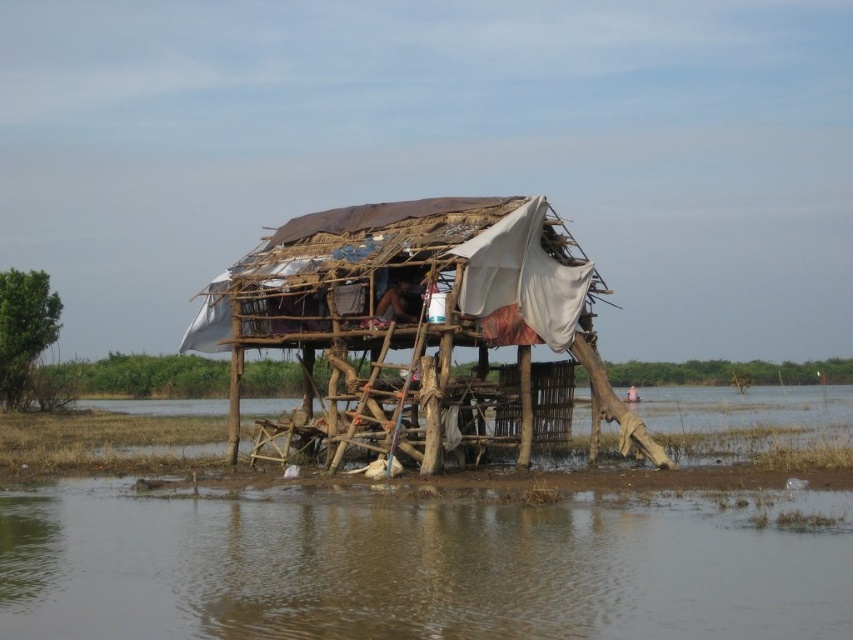
Who is positioned more to the right, brown muddy water at lower center or rusty wood shack at center?

brown muddy water at lower center is more to the right.

Who is more distant from viewer, (801,552) or (505,436)?

Point (505,436)

Find the location of a particular element. This screenshot has width=853, height=640. brown muddy water at lower center is located at coordinates (415, 566).